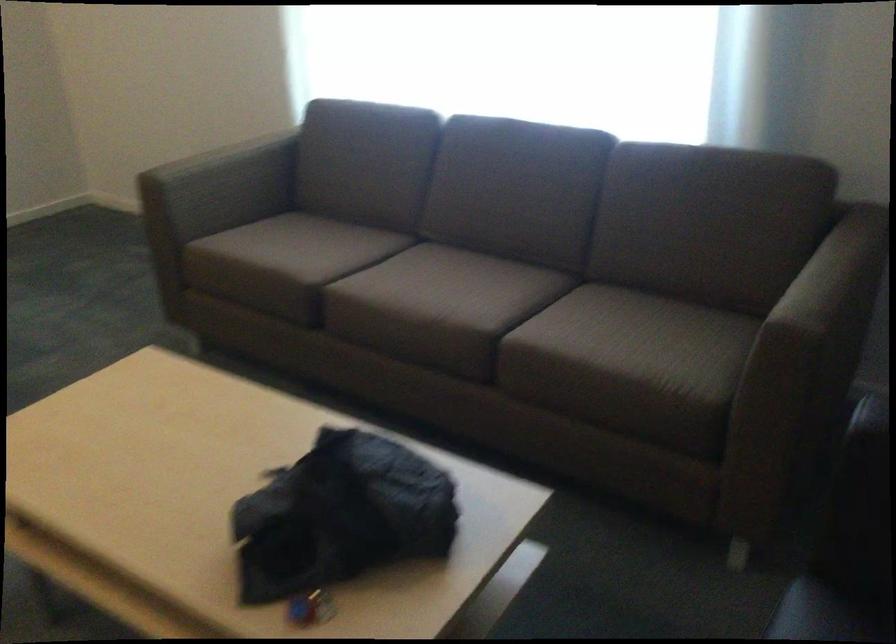
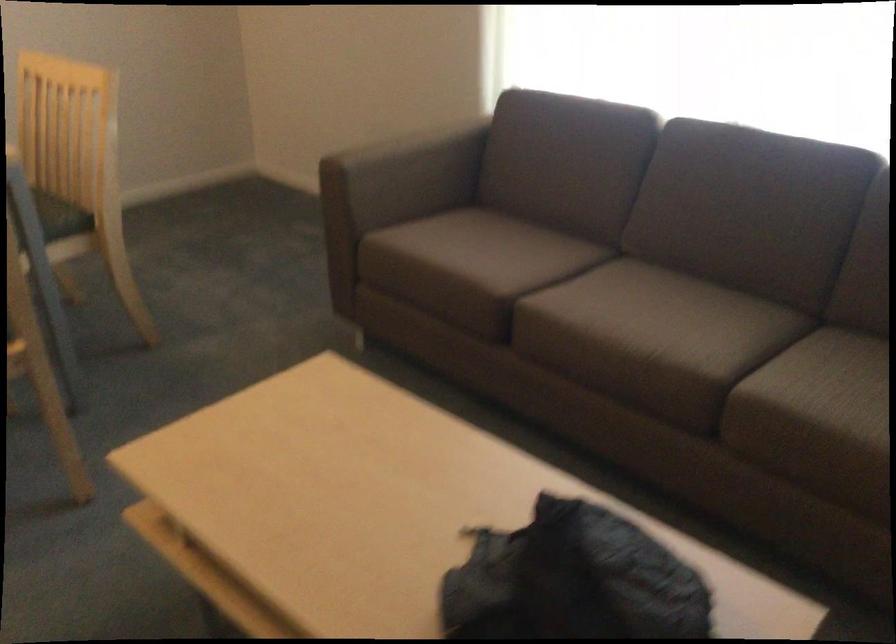
Locate, in the second image, the point that corresponds to point (220, 185) in the first image.

(403, 176)